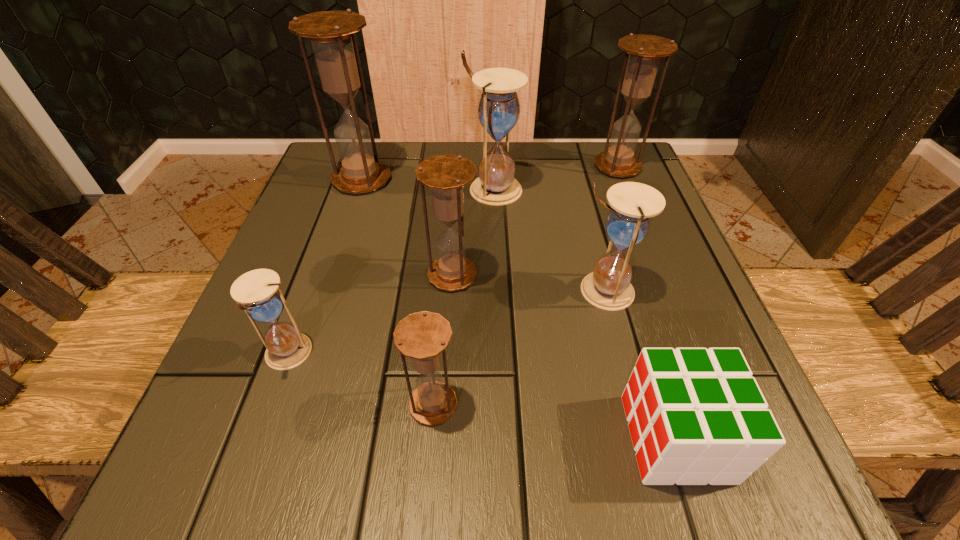
Identify the location of vacant region at the far edge of the desktop. The image size is (960, 540). (426, 157).

Image resolution: width=960 pixels, height=540 pixels. Find the location of `free space at the near edge of the desktop`. free space at the near edge of the desktop is located at coordinates (396, 450).

In the image, there is a desktop. Identify the location of vacant region at the left edge. (303, 322).

At what (x,y) coordinates should I click in order to perform the action: click on vacant area at the right edge. Please return your answer as a coordinate pair (x, y). Looking at the image, I should click on (659, 254).

In the image, there is a desktop. At what (x,y) coordinates should I click in order to perform the action: click on free region at the near left corner. Please return your answer as a coordinate pair (x, y). Looking at the image, I should click on (181, 480).

Identify the location of free space at the far right corner. The height and width of the screenshot is (540, 960). (648, 183).

Find the location of a particular element. The height and width of the screenshot is (540, 960). vacant area that lies between the tallest hourglass and the red cube is located at coordinates (519, 309).

Find the location of a particular element. The width and height of the screenshot is (960, 540). vacant point located between the red cube and the third nearest object is located at coordinates (482, 396).

Find the location of `free space between the nearest brown hourglass and the second biggest white hourglass`. free space between the nearest brown hourglass and the second biggest white hourglass is located at coordinates (517, 347).

The image size is (960, 540). I want to click on blank region between the third farthest brown hourglass and the second white hourglass from right to left, so click(x=472, y=232).